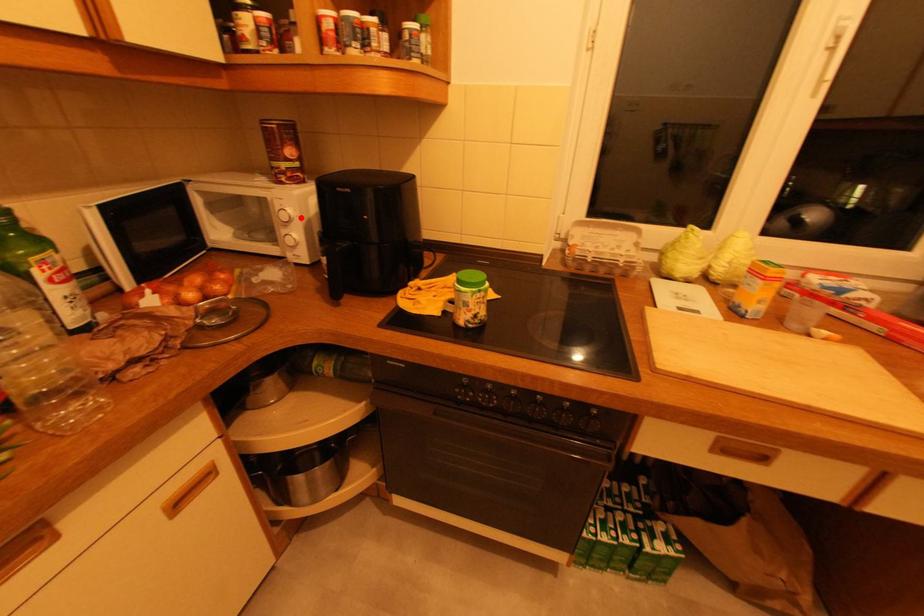
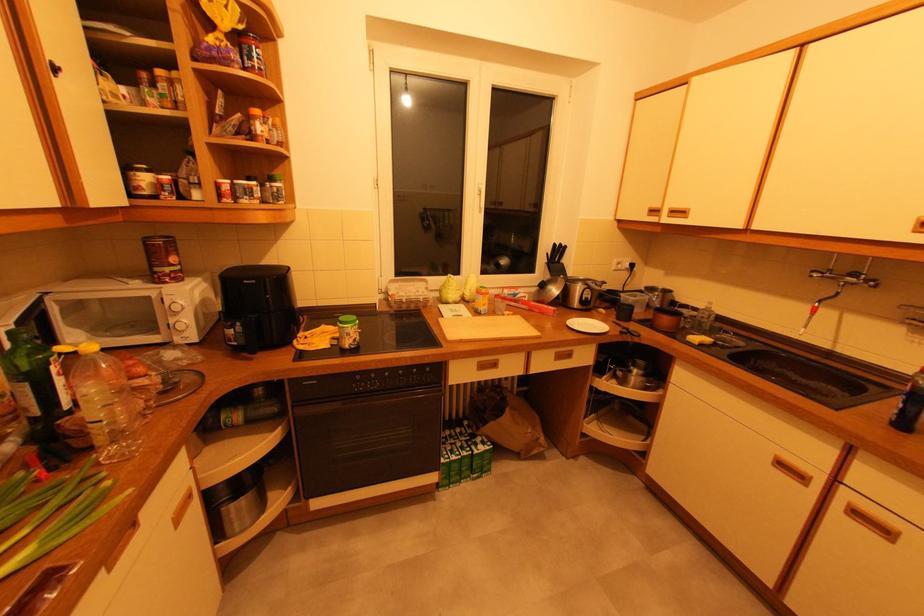
The point at the highlighted location is marked in the first image. Where is the corresponding point in the second image?

(190, 307)